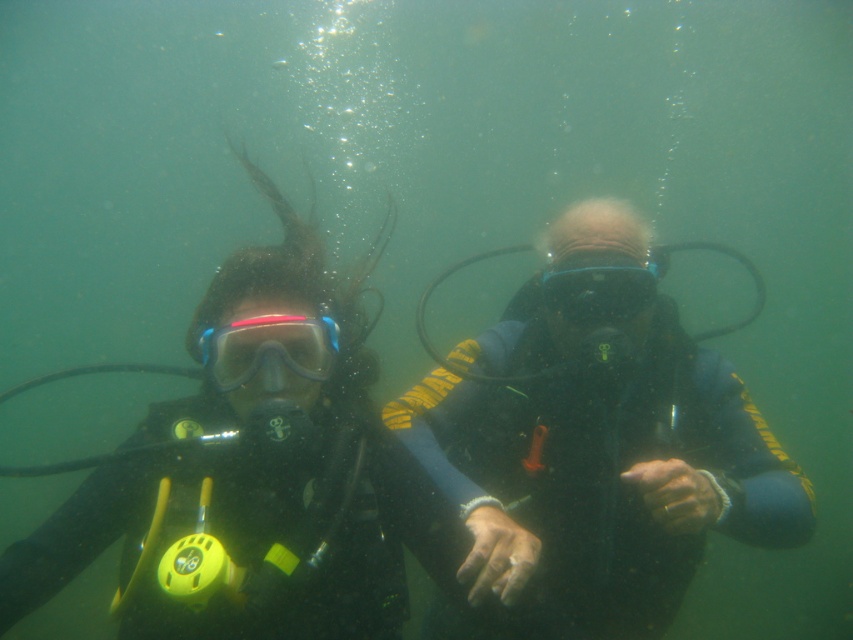
You are a marine biologist observing two divers underwater. You notice the black rubber wetsuit at center and the transparent rubber goggles at center. Which object is positioned to the right?

The transparent rubber goggles at center are positioned to the right of the black rubber wetsuit at center.

You are a marine biologist observing underwater. You notice the black rubber wetsuit at center and the transparent rubber goggles at center. Which object is positioned lower in the water?

The black rubber wetsuit at center is located below transparent rubber goggles at center, so the black rubber wetsuit at center is positioned lower in the water.

You are a marine biologist studying underwater equipment. You observe a point at coordinates [599,448] in the image. What object is located at that point?

The point at coordinates [599,448] corresponds to the black rubber wetsuit at center.